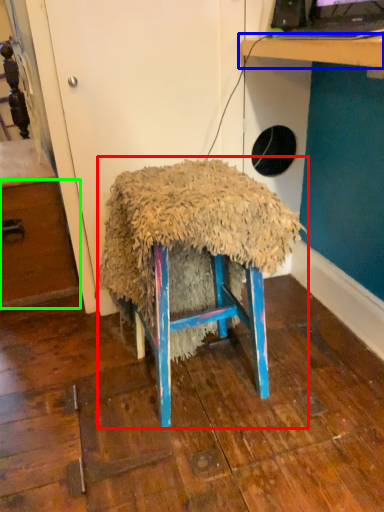
Question: Estimate the real-world distances between objects in this image. Which object is farther from furniture (highlighted by a red box), table (highlighted by a blue box) or drawer (highlighted by a green box)?

Choices:
 (A) table
 (B) drawer

Answer: (B)